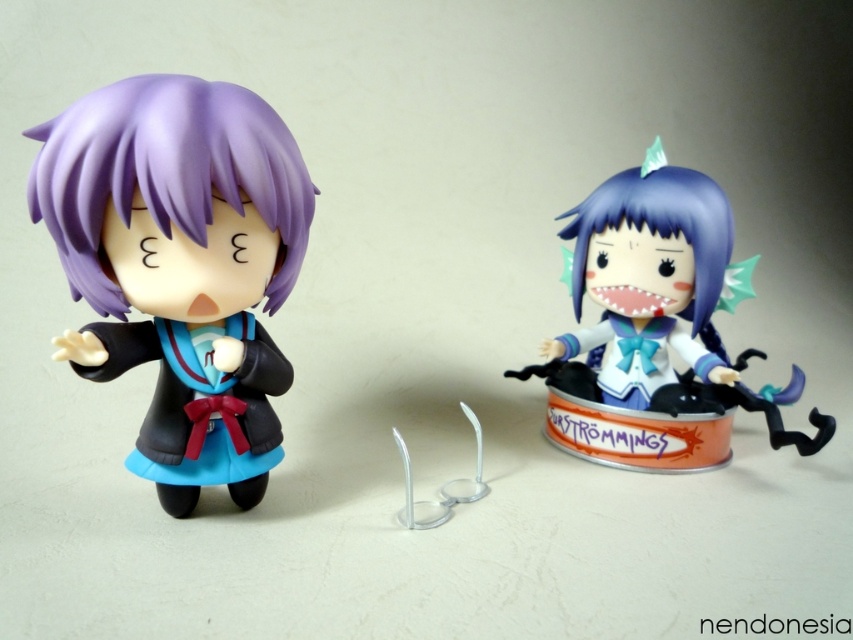
Looking at this image, does matte black doll at left appear under satin blue figurine at center?

Indeed, matte black doll at left is positioned under satin blue figurine at center.

Is matte black doll at left to the left of satin blue figurine at center from the viewer's perspective?

Yes, matte black doll at left is to the left of satin blue figurine at center.

Between point (224, 316) and point (577, 394), which one is positioned behind?

Point (577, 394)

Image resolution: width=853 pixels, height=640 pixels. Identify the location of matte black doll at left. (180, 262).